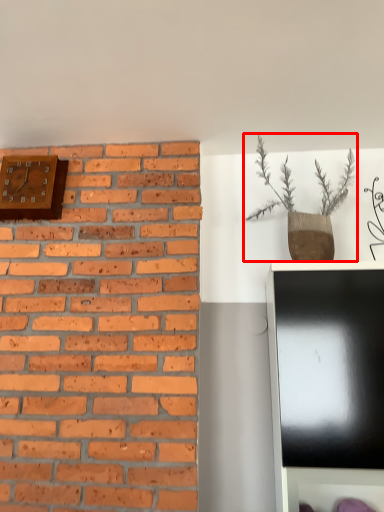
Question: Observing the image, what is the correct spatial positioning of houseplant (annotated by the red box) in reference to clock?

Choices:
 (A) right
 (B) left

Answer: (A)